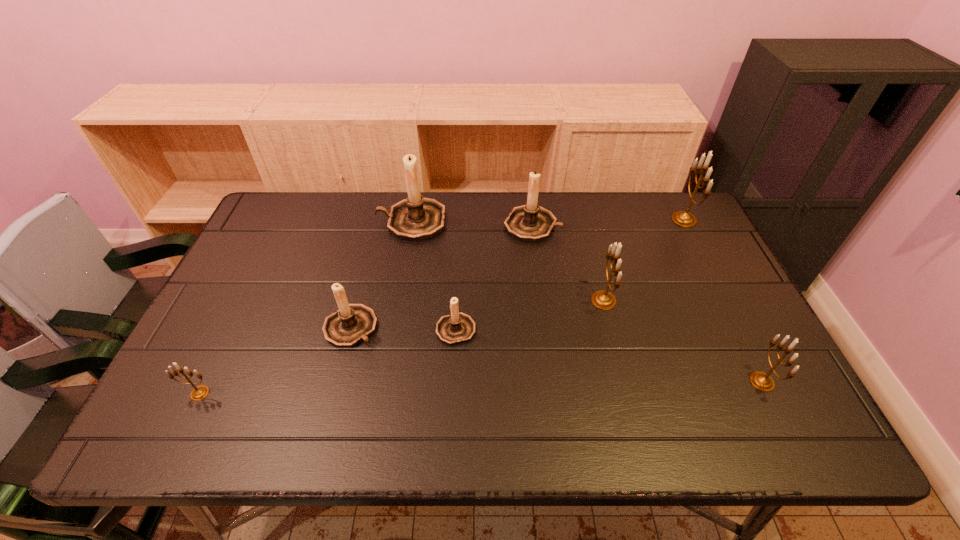
The width and height of the screenshot is (960, 540). I want to click on object that is positioned at the left edge, so click(198, 393).

Find the location of a particular element. This screenshot has width=960, height=540. object that is positioned at the far right corner is located at coordinates (681, 218).

In the image, there is a desktop. What are the coordinates of `vacant space at the far edge` in the screenshot? It's located at (626, 214).

Locate an element on the screen. The image size is (960, 540). vacant space at the near edge of the desktop is located at coordinates (291, 422).

Locate an element on the screen. The height and width of the screenshot is (540, 960). vacant region at the left edge of the desktop is located at coordinates (210, 373).

Image resolution: width=960 pixels, height=540 pixels. In the image, there is a desktop. What are the coordinates of `free space at the right edge` in the screenshot? It's located at (674, 280).

Locate an element on the screen. Image resolution: width=960 pixels, height=540 pixels. vacant area at the near left corner of the desktop is located at coordinates (161, 409).

Where is `empty space between the biggest brown candle holder and the smallest gold candelabrum`? The height and width of the screenshot is (540, 960). empty space between the biggest brown candle holder and the smallest gold candelabrum is located at coordinates 305,307.

The image size is (960, 540). What are the coordinates of `blank region between the third biggest gold candelabrum and the second smallest brown candle holder` in the screenshot? It's located at (557, 354).

Where is `blank region between the biggest gold candelabrum and the third biggest gold candelabrum`? This screenshot has width=960, height=540. blank region between the biggest gold candelabrum and the third biggest gold candelabrum is located at coordinates (723, 301).